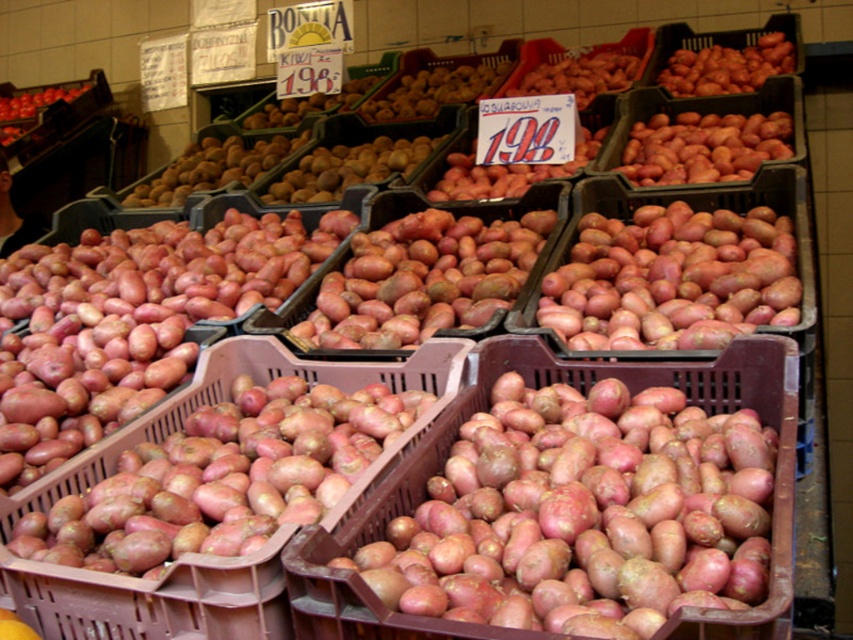
Which is behind, point (606, 636) or point (682, 74)?

Point (682, 74)

Who is more forward, [641,432] or [756,86]?

Point [641,432] is in front.

You are a GUI agent. You are given a task and a screenshot of the screen. Output one action in this format:
    pyautogui.click(x=<x>, y=<y>)
    Task: Click on the smooth red potatoes at center
    This screenshot has height=640, width=853.
    Given the screenshot: What is the action you would take?
    pyautogui.click(x=584, y=515)

Between smooth red potatoes at center and red matte potato at center, which one has more height?

red matte potato at center is taller.

In the scene shown: Does smooth red potatoes at center have a larger size compared to red matte potato at center?

Incorrect, smooth red potatoes at center is not larger than red matte potato at center.

Does point (515, 595) come farther from viewer compared to point (599, 324)?

No, it is not.

Image resolution: width=853 pixels, height=640 pixels. I want to click on smooth red potatoes at center, so click(584, 515).

Is point (80, 508) positioned in front of point (761, 84)?

Yes, it is.

Which is in front, point (276, 403) or point (670, 67)?

Point (276, 403) is more forward.

Is point (309, 481) closer to viewer compared to point (729, 64)?

That is True.

The height and width of the screenshot is (640, 853). In order to click on matte red potato at center in this screenshot , I will do `click(223, 477)`.